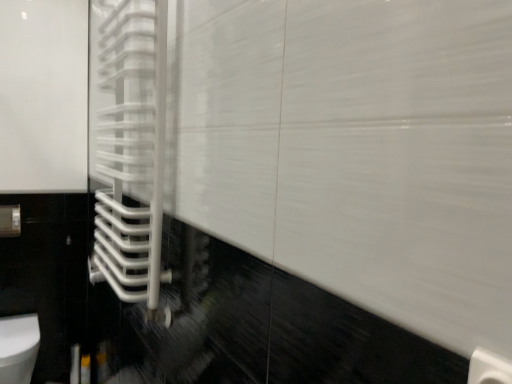
In order to face white glossy toilet at lower left, should I rotate leftwards or rightwards?

Rotate left and turn 29.099 degrees.

This screenshot has width=512, height=384. In order to click on white glossy toilet at lower left in this screenshot , I will do `click(18, 348)`.

What do you see at coordinates (18, 348) in the screenshot? I see `white glossy toilet at lower left` at bounding box center [18, 348].

What is the approximate height of white glossy towel rack at left?

white glossy towel rack at left is 3.68 feet in height.

The height and width of the screenshot is (384, 512). What are the coordinates of `white glossy towel rack at left` in the screenshot? It's located at (132, 150).

What do you see at coordinates (132, 150) in the screenshot? I see `white glossy towel rack at left` at bounding box center [132, 150].

Identify the location of white glossy toilet at lower left. The height and width of the screenshot is (384, 512). (18, 348).

Can you confirm if white glossy toilet at lower left is positioned to the right of white glossy towel rack at left?

No, white glossy toilet at lower left is not to the right of white glossy towel rack at left.

Based on the photo, which object is closer to the camera taking this photo, white glossy toilet at lower left or white glossy towel rack at left?

white glossy towel rack at left.

Between point (5, 364) and point (126, 45), which one is positioned behind?

The point (5, 364) is farther from the camera.

From the image's perspective, who appears lower, white glossy toilet at lower left or white glossy towel rack at left?

white glossy toilet at lower left.

From a real-world perspective, is white glossy toilet at lower left positioned above or below white glossy towel rack at left?

white glossy toilet at lower left is situated lower than white glossy towel rack at left in the real world.

From the picture: Between white glossy toilet at lower left and white glossy towel rack at left, which one has larger width?

Wider between the two is white glossy toilet at lower left.

Does white glossy toilet at lower left have a lesser height compared to white glossy towel rack at left?

Correct, white glossy toilet at lower left is not as tall as white glossy towel rack at left.

Can you confirm if white glossy toilet at lower left is bigger than white glossy towel rack at left?

No.

Would you say white glossy toilet at lower left is inside or outside white glossy towel rack at left?

white glossy toilet at lower left cannot be found inside white glossy towel rack at left.

Would you say white glossy toilet at lower left is a long distance from white glossy towel rack at left?

Absolutely, white glossy toilet at lower left is distant from white glossy towel rack at left.

Is white glossy toilet at lower left oriented away from white glossy towel rack at left?

No, white glossy towel rack at left is not at the back of white glossy toilet at lower left.

How much distance is there between white glossy toilet at lower left and white glossy towel rack at left?

white glossy toilet at lower left and white glossy towel rack at left are 1.01 meters apart from each other.

Where is `shower door above the white glossy toilet at lower left (from the image's perspective)`? Image resolution: width=512 pixels, height=384 pixels. shower door above the white glossy toilet at lower left (from the image's perspective) is located at coordinates pos(132,150).

Does white glossy towel rack at left appear on the left side of white glossy toilet at lower left?

In fact, white glossy towel rack at left is to the right of white glossy toilet at lower left.

Between white glossy towel rack at left and white glossy toilet at lower left, which one is positioned behind?

Positioned behind is white glossy toilet at lower left.

Which is in front, point (146, 170) or point (20, 373)?

The point (146, 170) is closer.

From the image's perspective, which is below, white glossy towel rack at left or white glossy toilet at lower left?

white glossy toilet at lower left, from the image's perspective.

From a real-world perspective, is white glossy towel rack at left on white glossy toilet at lower left?

Indeed, from a real-world perspective, white glossy towel rack at left stands above white glossy toilet at lower left.

Which object is wider, white glossy towel rack at left or white glossy toilet at lower left?

With larger width is white glossy toilet at lower left.

Is white glossy towel rack at left taller than white glossy toilet at lower left?

Correct, white glossy towel rack at left is much taller as white glossy toilet at lower left.

Which of these two, white glossy towel rack at left or white glossy toilet at lower left, is smaller?

white glossy toilet at lower left.

Is white glossy toilet at lower left a part of white glossy towel rack at left?

No, white glossy toilet at lower left is not surrounded by white glossy towel rack at left.

Based on the photo, is white glossy towel rack at left with white glossy toilet at lower left?

No, white glossy towel rack at left is not next to white glossy toilet at lower left.

Is white glossy towel rack at left turned away from white glossy toilet at lower left?

No, white glossy towel rack at left's orientation is not away from white glossy toilet at lower left.

How different are the orientations of white glossy towel rack at left and white glossy toilet at lower left in degrees?

There is a 90-degree angle between the facing directions of white glossy towel rack at left and white glossy toilet at lower left.

You are a GUI agent. You are given a task and a screenshot of the screen. Output one action in this format:
    pyautogui.click(x=<x>, y=<y>)
    Task: Click on the toilet on the left of white glossy towel rack at left
    
    Given the screenshot: What is the action you would take?
    pyautogui.click(x=18, y=348)

This screenshot has height=384, width=512. In order to click on shower door in front of the white glossy toilet at lower left in this screenshot , I will do `click(132, 150)`.

The height and width of the screenshot is (384, 512). In order to click on toilet below the white glossy towel rack at left (from the image's perspective) in this screenshot , I will do `click(18, 348)`.